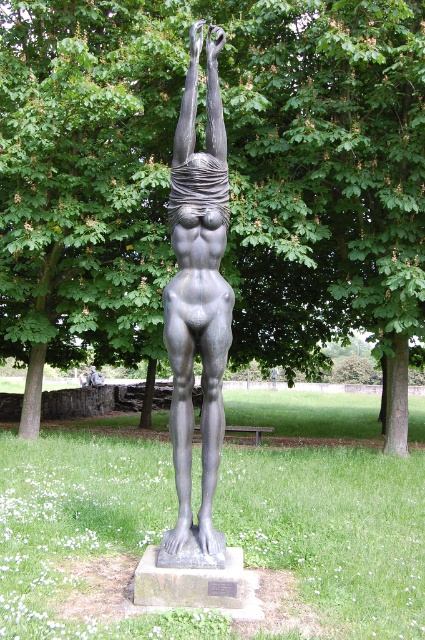
Measure the distance between green leafy tree at center and camera.

31.11 feet

In the scene shown: Who is positioned more to the left, green leafy tree at center or matte bronze statue at center?

Positioned to the left is green leafy tree at center.

Which is in front, point (303, 236) or point (210, 150)?

Point (210, 150) is in front.

What are the coordinates of `green leafy tree at center` in the screenshot? It's located at (229, 172).